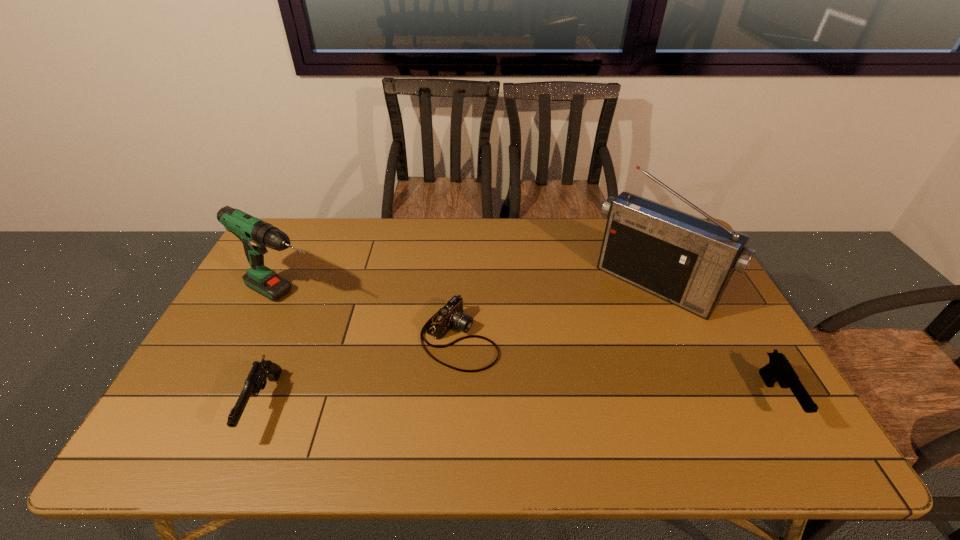
Locate an element on the screen. The image size is (960, 540). vacant region between the gun and the shortest object is located at coordinates (361, 372).

I want to click on free area in between the pistol and the gun, so click(x=520, y=402).

Where is `unoccupied area between the gun and the tallest object`? The height and width of the screenshot is (540, 960). unoccupied area between the gun and the tallest object is located at coordinates (459, 346).

Find the location of `free spot between the pistol and the radio receiver`. free spot between the pistol and the radio receiver is located at coordinates (715, 342).

Where is `vacant area that lies between the second tallest object and the radio receiver`? vacant area that lies between the second tallest object and the radio receiver is located at coordinates (470, 292).

Identify the location of unoccupied area between the camera and the drill. (373, 318).

The height and width of the screenshot is (540, 960). I want to click on free space between the tallest object and the fourth shortest object, so click(x=470, y=292).

Locate an element on the screen. The height and width of the screenshot is (540, 960). free space that is in between the radio receiver and the gun is located at coordinates (459, 346).

This screenshot has height=540, width=960. Find the location of `free space between the gun and the radio receiver`. free space between the gun and the radio receiver is located at coordinates [x=459, y=346].

You are a GUI agent. You are given a task and a screenshot of the screen. Output one action in this format:
    pyautogui.click(x=<x>, y=<y>)
    Task: Click on the vacant space that is in between the shortest object and the pistol
    Image resolution: width=960 pixels, height=540 pixels.
    Given the screenshot: What is the action you would take?
    coord(618,368)